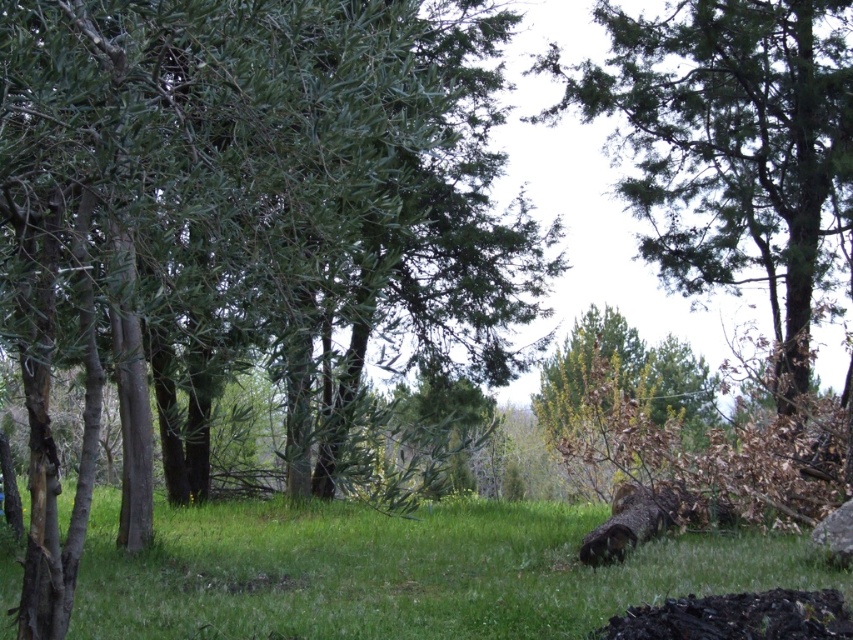
In the scene shown: You are standing at the center of the grassy area and want to walk towards the green leafy tree at center. According to the coordinates provided, in which direction should you head?

The green leafy tree at center is located at coordinates point (x=248, y=221), so you should head towards the upper left direction from your current position at the center.

Based on the photo, you are standing at the origin point of the image. Which direction should you move to reach the green leafy tree at center?

The green leafy tree at center is located at coordinates approximately 0.347 along the x axis and 0.292 along the y axis. Since you are at the origin, you should move right along the x axis and up along the y axis to reach it.